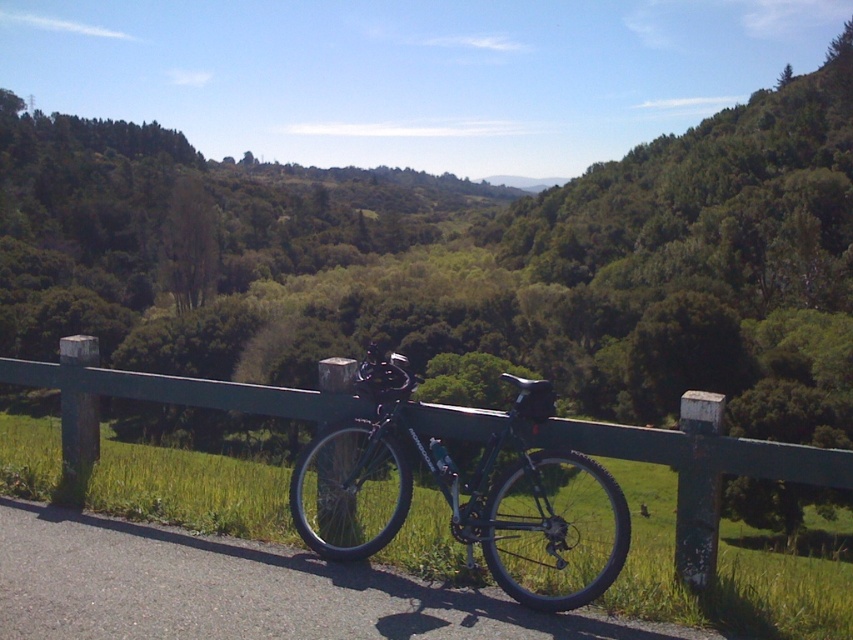
You are a hiker who wants to take a photo of the matte black bicycle at center from behind the green metal fence at center. Can you see the entire bicycle without any obstruction from the fence?

The green metal fence at center has a lesser height compared to matte black bicycle at center, so yes, you can see the entire bicycle without any obstruction from the fence since the fence is shorter than the bicycle.

You are a hiker who wants to take a photo of the matte black bicycle at center. You notice the green metal fence at center is blocking your view. Can you move closer to the fence to get a clear shot of the bicycle?

The green metal fence at center is in front of matte black bicycle at center, so moving closer to the fence would bring both objects into focus. However, since the fence is blocking the view, you might need to step around it or adjust your angle to capture the bicycle without obstruction.